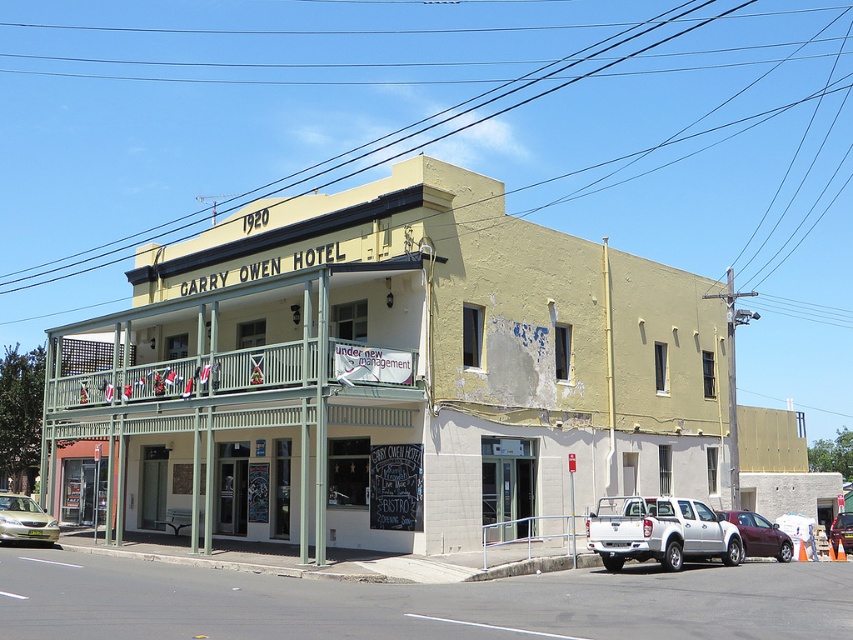
Question: Which object appears farthest from the camera in this image?

Choices:
 (A) silver metallic pickup truck at lower right
 (B) green painted wood balcony at center
 (C) maroon metallic sedan at lower right

Answer: (C)

Question: Is green painted wood balcony at center closer to the viewer compared to maroon metallic sedan at lower right?

Choices:
 (A) no
 (B) yes

Answer: (B)

Question: Does green painted wood balcony at center have a smaller size compared to maroon metallic sedan at lower right?

Choices:
 (A) no
 (B) yes

Answer: (A)

Question: Is yellow painted building at center further to camera compared to maroon metallic sedan at lower right?

Choices:
 (A) yes
 (B) no

Answer: (B)

Question: Estimate the real-world distances between objects in this image. Which object is farther from the silver metallic pickup truck at lower right?

Choices:
 (A) green painted wood balcony at center
 (B) metallic silver sedan at center

Answer: (B)

Question: Which is nearer to the yellow painted building at center?

Choices:
 (A) maroon metallic sedan at lower right
 (B) silver metallic sedan at lower left

Answer: (B)